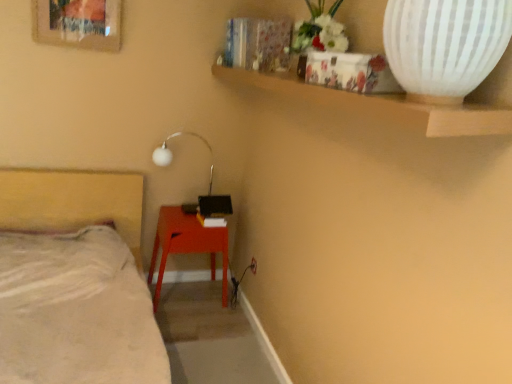
Question: Are white ribbed vase at upper right and matte red table at lower center far apart?

Choices:
 (A) yes
 (B) no

Answer: (A)

Question: Is white ribbed vase at upper right looking in the opposite direction of matte red table at lower center?

Choices:
 (A) yes
 (B) no

Answer: (B)

Question: Considering the relative sizes of white ribbed vase at upper right and matte red table at lower center in the image provided, is white ribbed vase at upper right smaller than matte red table at lower center?

Choices:
 (A) yes
 (B) no

Answer: (A)

Question: Is white ribbed vase at upper right next to matte red table at lower center?

Choices:
 (A) yes
 (B) no

Answer: (B)

Question: Is white ribbed vase at upper right aimed at matte red table at lower center?

Choices:
 (A) no
 (B) yes

Answer: (A)

Question: From a real-world perspective, is white ribbed vase at upper right positioned above or below wooden picture frame at upper left?

Choices:
 (A) above
 (B) below

Answer: (B)

Question: Considering the positions of white ribbed vase at upper right and wooden picture frame at upper left in the image, is white ribbed vase at upper right bigger or smaller than wooden picture frame at upper left?

Choices:
 (A) big
 (B) small

Answer: (A)

Question: From their relative heights in the image, would you say white ribbed vase at upper right is taller or shorter than wooden picture frame at upper left?

Choices:
 (A) tall
 (B) short

Answer: (B)

Question: In the image, is white ribbed vase at upper right on the left side or the right side of wooden picture frame at upper left?

Choices:
 (A) right
 (B) left

Answer: (A)

Question: Considering their positions, is white ribbed vase at upper right located in front of or behind matte red table at lower center?

Choices:
 (A) front
 (B) behind

Answer: (A)

Question: Considering the positions of point (489, 6) and point (197, 230), is point (489, 6) closer or farther from the camera than point (197, 230)?

Choices:
 (A) closer
 (B) farther

Answer: (A)

Question: Considering the positions of white ribbed vase at upper right and matte red table at lower center in the image, is white ribbed vase at upper right taller or shorter than matte red table at lower center?

Choices:
 (A) tall
 (B) short

Answer: (B)

Question: Based on their positions, is white ribbed vase at upper right located to the left or right of matte red table at lower center?

Choices:
 (A) right
 (B) left

Answer: (A)

Question: From a real-world perspective, is matte red table at lower center physically located above or below white ribbed vase at upper right?

Choices:
 (A) above
 (B) below

Answer: (B)

Question: Considering the positions of matte red table at lower center and white ribbed vase at upper right in the image, is matte red table at lower center taller or shorter than white ribbed vase at upper right?

Choices:
 (A) tall
 (B) short

Answer: (A)